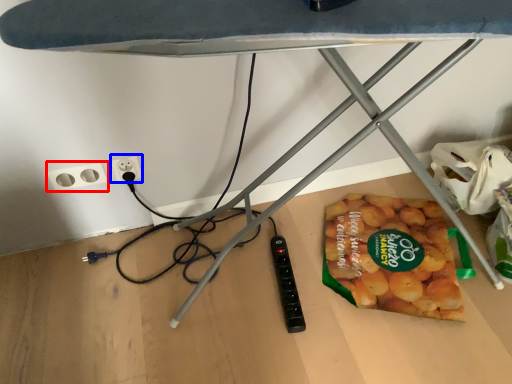
Question: Which point is further to the camera, socket (highlighted by a red box) or electric outlet (highlighted by a blue box)?

Choices:
 (A) socket
 (B) electric outlet

Answer: (B)